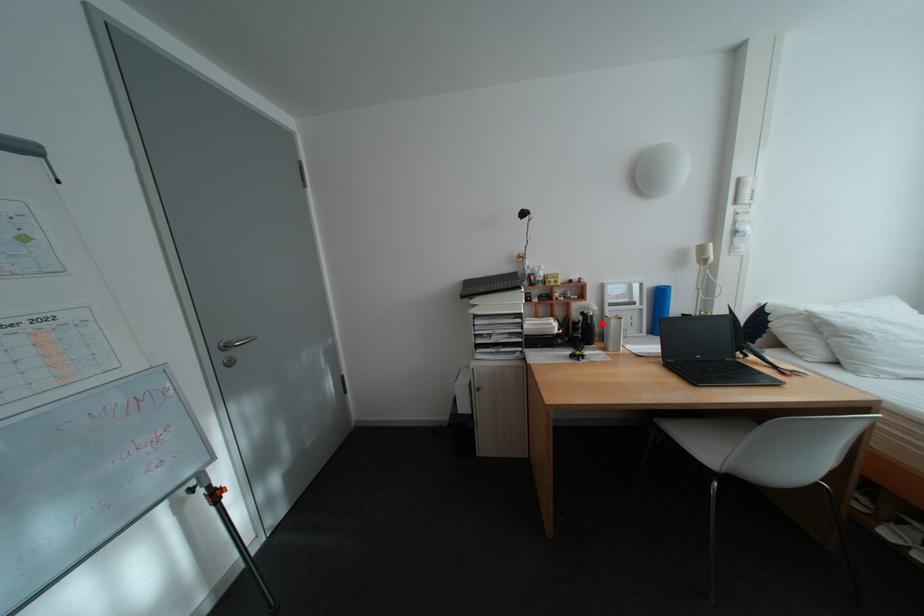
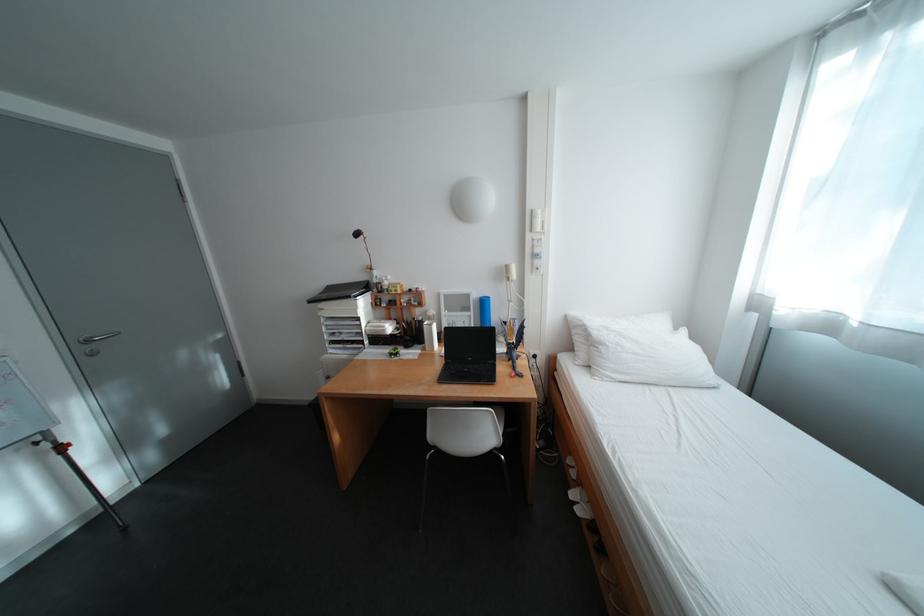
In the second image, find the point that corresponds to the highlighted location in the first image.

(430, 326)